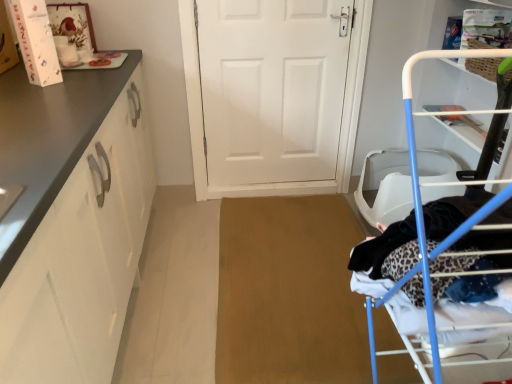
Question: From a real-world perspective, is blue metal drying rack at right positioned under matte white cabinet at left based on gravity?

Choices:
 (A) yes
 (B) no

Answer: (B)

Question: Is matte white cabinet at left at the back of blue metal drying rack at right?

Choices:
 (A) no
 (B) yes

Answer: (A)

Question: Does blue metal drying rack at right have a smaller size compared to matte white cabinet at left?

Choices:
 (A) yes
 (B) no

Answer: (A)

Question: Does blue metal drying rack at right appear on the right side of matte white cabinet at left?

Choices:
 (A) yes
 (B) no

Answer: (A)

Question: Does blue metal drying rack at right come behind matte white cabinet at left?

Choices:
 (A) yes
 (B) no

Answer: (B)

Question: From a real-world perspective, is matte white cabinet at left positioned above or below white matte door at center?

Choices:
 (A) below
 (B) above

Answer: (A)

Question: Choose the correct answer: Is matte white cabinet at left inside white matte door at center or outside it?

Choices:
 (A) outside
 (B) inside

Answer: (A)

Question: Relative to white matte door at center, is matte white cabinet at left in front or behind?

Choices:
 (A) behind
 (B) front

Answer: (B)

Question: Is matte white cabinet at left bigger or smaller than white matte door at center?

Choices:
 (A) small
 (B) big

Answer: (B)

Question: From their relative heights in the image, would you say white matte door at center is taller or shorter than matte white cabinet at left?

Choices:
 (A) short
 (B) tall

Answer: (B)

Question: Is white matte door at center situated inside matte white cabinet at left or outside?

Choices:
 (A) inside
 (B) outside

Answer: (B)

Question: Is white matte door at center in front of or behind matte white cabinet at left in the image?

Choices:
 (A) behind
 (B) front

Answer: (A)

Question: Considering the positions of white matte door at center and matte white cabinet at left in the image, is white matte door at center bigger or smaller than matte white cabinet at left?

Choices:
 (A) small
 (B) big

Answer: (A)

Question: In the image, is blue metal drying rack at right on the left side or the right side of matte white cabinet at left?

Choices:
 (A) left
 (B) right

Answer: (B)

Question: In terms of height, does blue metal drying rack at right look taller or shorter compared to matte white cabinet at left?

Choices:
 (A) short
 (B) tall

Answer: (B)